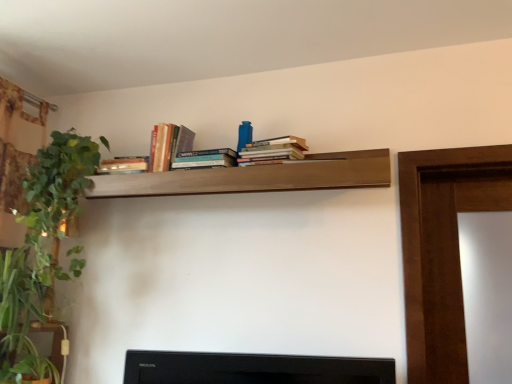
Measure the distance between hardcover books at upper center, the first book viewed from the left, and camera.

hardcover books at upper center, the first book viewed from the left, is 1.59 meters away from camera.

The image size is (512, 384). What are the coordinates of `green leafy plant at left` in the screenshot? It's located at (20, 322).

The height and width of the screenshot is (384, 512). I want to click on hardcover books at center, the 2th book viewed from the left, so (205, 159).

Based on their positions, is wooden shelf at upper center located to the left or right of hardcover books at center, the 2th book viewed from the left?

wooden shelf at upper center is positioned on hardcover books at center, the 2th book viewed from the left,'s right side.

Can you confirm if wooden shelf at upper center is taller than hardcover books at center, positioned as the second book in right-to-left order?

Yes, wooden shelf at upper center is taller than hardcover books at center, positioned as the second book in right-to-left order.

Are wooden shelf at upper center and hardcover books at center, the 2th book viewed from the left, making contact?

No, wooden shelf at upper center is not beside hardcover books at center, the 2th book viewed from the left.

Locate an element on the screen. The image size is (512, 384). shelf positioned vertically above the green leafy plant at left (from a real-world perspective) is located at coordinates (256, 177).

From a real-world perspective, is green leafy plant at left below wooden shelf at upper center?

Yes, from a real-world perspective, green leafy plant at left is under wooden shelf at upper center.

Consider the image. From the image's perspective, is green leafy plant at left located above or below wooden shelf at upper center?

Clearly, from the image's perspective, green leafy plant at left is below wooden shelf at upper center.

Is point (192, 139) closer or farther from the camera than point (191, 152)?

Point (192, 139) is farther from the camera than point (191, 152).

Is hardcover books at upper center, arranged as the 3th book when viewed from the right, spatially inside hardcover books at center, positioned as the second book in right-to-left order, or outside of it?

hardcover books at upper center, arranged as the 3th book when viewed from the right, is not enclosed by hardcover books at center, positioned as the second book in right-to-left order.

Does hardcover books at upper center, the first book viewed from the left, come behind hardcover books at center, the 2th book viewed from the left?

Yes, the depth of hardcover books at upper center, the first book viewed from the left, is greater than that of hardcover books at center, the 2th book viewed from the left.

Considering the sizes of objects hardcover books at upper center, the first book viewed from the left, and hardcover books at center, the 2th book viewed from the left, in the image provided, who is bigger, hardcover books at upper center, the first book viewed from the left, or hardcover books at center, the 2th book viewed from the left,?

hardcover books at upper center, the first book viewed from the left.

Which object is positioned more to the left, green leafy plant at left or hardcover books at center, acting as the first book starting from the right?

green leafy plant at left is more to the left.

Looking at this image, from the image's perspective, which one is positioned higher, green leafy plant at left or hardcover books at center, which is the 3th book from left to right?

hardcover books at center, which is the 3th book from left to right.

Who is taller, green leafy plant at left or hardcover books at center, which is the 3th book from left to right?

green leafy plant at left is taller.

Is the depth of green leafy plant at left less than that of hardcover books at center, which is the 3th book from left to right?

Yes, it is in front of hardcover books at center, which is the 3th book from left to right.

From the image's perspective, starting from the wooden shelf at upper center, which book is the 3rd one above? Please provide its 2D coordinates.

[(168, 145)]

Which object is closer to the camera taking this photo, hardcover books at upper center, arranged as the 3th book when viewed from the right, or wooden shelf at upper center?

Positioned in front is wooden shelf at upper center.

Considering the sizes of objects hardcover books at upper center, arranged as the 3th book when viewed from the right, and wooden shelf at upper center in the image provided, who is smaller, hardcover books at upper center, arranged as the 3th book when viewed from the right, or wooden shelf at upper center?

With smaller size is hardcover books at upper center, arranged as the 3th book when viewed from the right.

From a real-world perspective, who is located lower, hardcover books at center, positioned as the second book in right-to-left order, or hardcover books at center, acting as the first book starting from the right?

From a 3D spatial view, hardcover books at center, acting as the first book starting from the right, is below.

Does hardcover books at center, positioned as the second book in right-to-left order, have a greater height compared to hardcover books at center, which is the 3th book from left to right?

Incorrect, the height of hardcover books at center, positioned as the second book in right-to-left order, is not larger of that of hardcover books at center, which is the 3th book from left to right.

Considering the positions of objects hardcover books at center, the 2th book viewed from the left, and hardcover books at center, acting as the first book starting from the right, in the image provided, who is behind, hardcover books at center, the 2th book viewed from the left, or hardcover books at center, acting as the first book starting from the right,?

hardcover books at center, the 2th book viewed from the left, is further away from the camera.

From the image's perspective, is hardcover books at center, positioned as the second book in right-to-left order, located above hardcover books at center, acting as the first book starting from the right?

Yes, from the image's perspective, hardcover books at center, positioned as the second book in right-to-left order, is on top of hardcover books at center, acting as the first book starting from the right.

Measure the distance from green leafy plant at left to hardcover books at upper center, arranged as the 3th book when viewed from the right.

21.34 inches.

Between green leafy plant at left and hardcover books at upper center, arranged as the 3th book when viewed from the right, which one has smaller width?

hardcover books at upper center, arranged as the 3th book when viewed from the right, is thinner.

From a real-world perspective, which object rests below the other?

green leafy plant at left, from a real-world perspective.

Locate an element on the screen. This screenshot has height=384, width=512. the 2nd book behind when counting from the wooden shelf at upper center is located at coordinates (205, 159).

What are the coordinates of `shelf above the green leafy plant at left (from the image's perspective)` in the screenshot? It's located at (256, 177).

Which object lies further to the anchor point wooden shelf at upper center, hardcover books at upper center, arranged as the 3th book when viewed from the right, or hardcover books at center, the 2th book viewed from the left?

hardcover books at upper center, arranged as the 3th book when viewed from the right, lies further to wooden shelf at upper center than the other object.

Based on their spatial positions, is hardcover books at center, acting as the first book starting from the right, or wooden shelf at upper center further from hardcover books at center, the 2th book viewed from the left?

wooden shelf at upper center.

Which object lies nearer to the anchor point hardcover books at upper center, arranged as the 3th book when viewed from the right, green leafy plant at left or wooden shelf at upper center?

The object closer to hardcover books at upper center, arranged as the 3th book when viewed from the right, is wooden shelf at upper center.

Based on their spatial positions, is hardcover books at center, the 2th book viewed from the left, or hardcover books at center, which is the 3th book from left to right, closer to hardcover books at upper center, arranged as the 3th book when viewed from the right?

hardcover books at center, the 2th book viewed from the left, is closer to hardcover books at upper center, arranged as the 3th book when viewed from the right.

When comparing their distances from green leafy plant at left, does green leafy plant at left or hardcover books at center, the 2th book viewed from the left, seem further?

The object further to green leafy plant at left is hardcover books at center, the 2th book viewed from the left.

Considering their positions, is hardcover books at center, acting as the first book starting from the right, positioned closer to hardcover books at center, positioned as the second book in right-to-left order, than green leafy plant at left?

hardcover books at center, acting as the first book starting from the right, is positioned closer to the anchor hardcover books at center, positioned as the second book in right-to-left order.

Which object lies further to the anchor point wooden shelf at upper center, green leafy plant at left or green leafy plant at left?

green leafy plant at left is further to wooden shelf at upper center.

Estimate the real-world distances between objects in this image. Which object is closer to wooden shelf at upper center, green leafy plant at left or hardcover books at center, the 2th book viewed from the left?

hardcover books at center, the 2th book viewed from the left.

Where is `shelf located between hardcover books at center, positioned as the second book in right-to-left order, and hardcover books at center, acting as the first book starting from the right, in the left-right direction`? shelf located between hardcover books at center, positioned as the second book in right-to-left order, and hardcover books at center, acting as the first book starting from the right, in the left-right direction is located at coordinates (256, 177).

Where is `houseplant between green leafy plant at left and wooden shelf at upper center in the horizontal direction`? This screenshot has width=512, height=384. houseplant between green leafy plant at left and wooden shelf at upper center in the horizontal direction is located at coordinates coord(41,249).

Find the location of a particular element. Image resolution: width=512 pixels, height=384 pixels. houseplant between green leafy plant at left and hardcover books at center, which is the 3th book from left to right, in the horizontal direction is located at coordinates coord(41,249).

At what (x,y) coordinates should I click in order to perform the action: click on shelf situated between hardcover books at upper center, the first book viewed from the left, and hardcover books at center, acting as the first book starting from the right, from left to right. Please return your answer as a coordinate pair (x, y). Looking at the image, I should click on (256, 177).